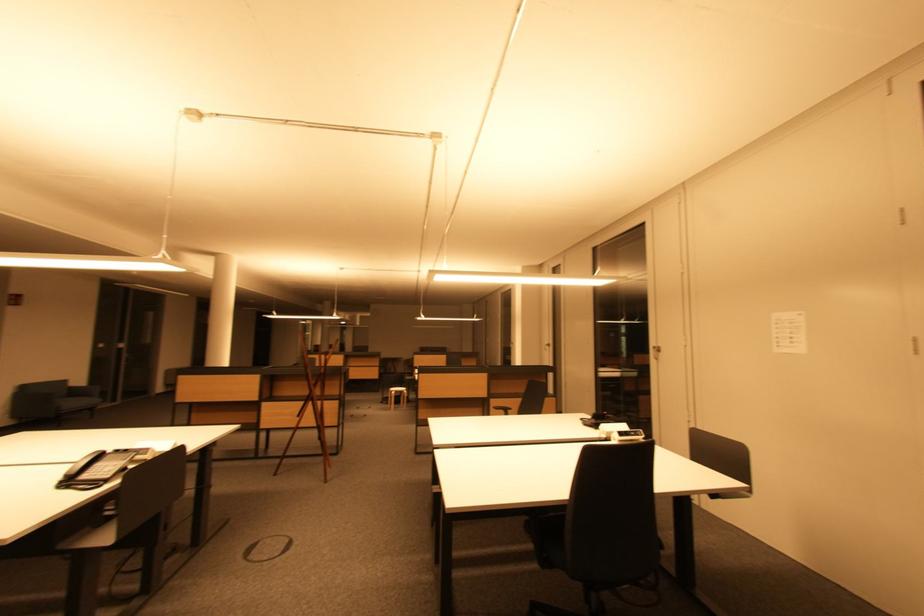
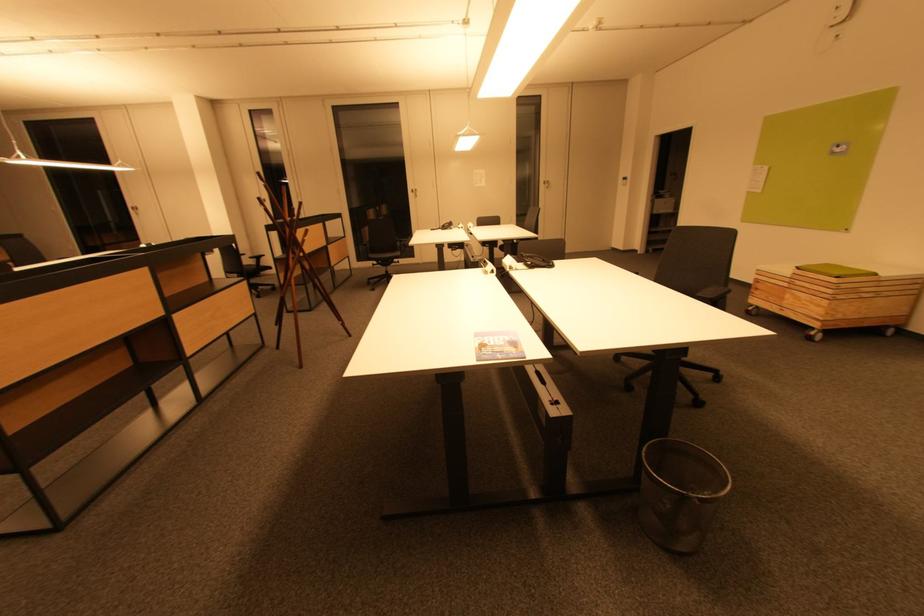
The point at (x=663, y=350) is marked in the first image. Where is the corresponding point in the second image?

(419, 191)